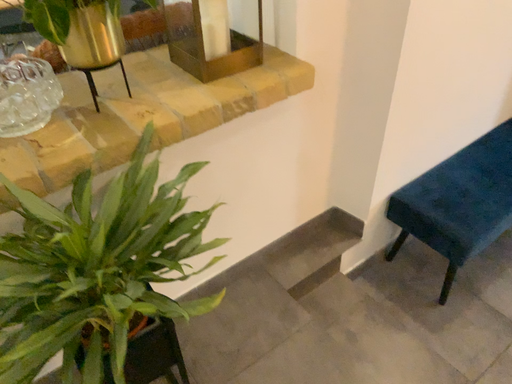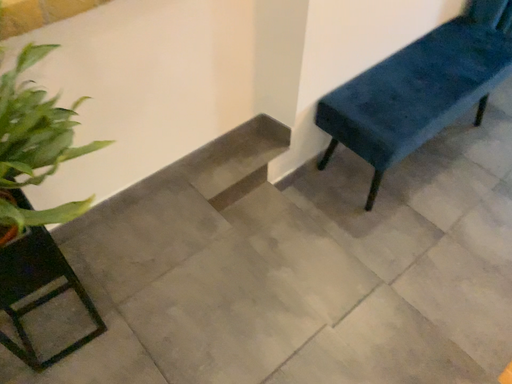
Question: How did the camera likely rotate when shooting the video?

Choices:
 (A) rotated upward
 (B) rotated downward

Answer: (B)